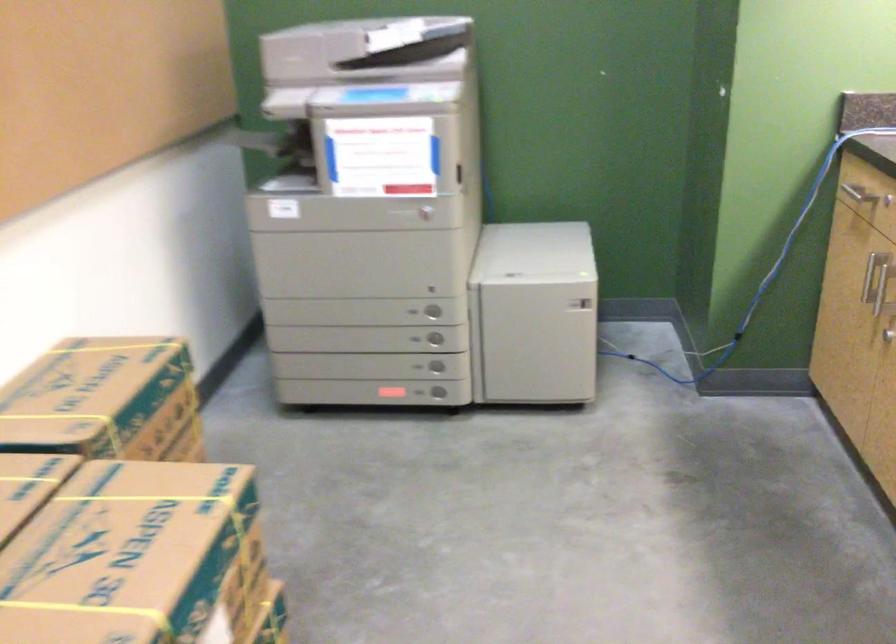
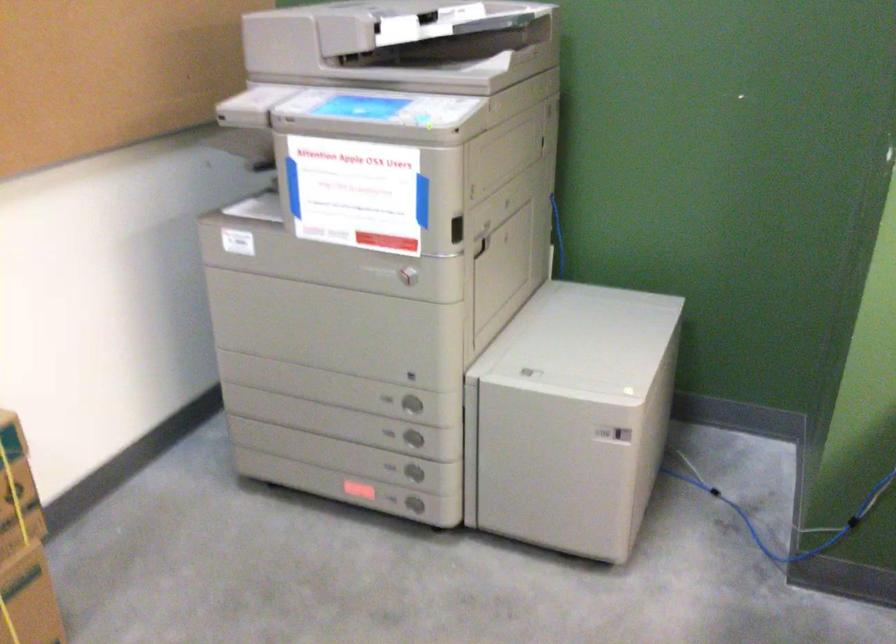
In the second image, find the point that corresponds to point 553,299 in the first image.

(572, 418)